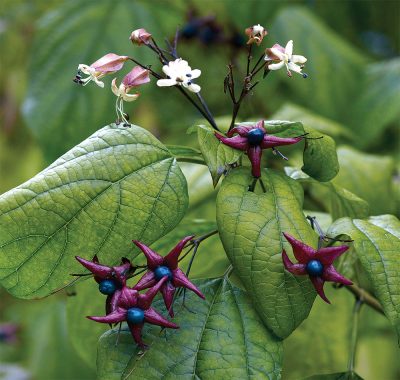
The width and height of the screenshot is (400, 380). I want to click on blue bulbs, so click(315, 265), click(135, 319), click(161, 270), click(108, 288).